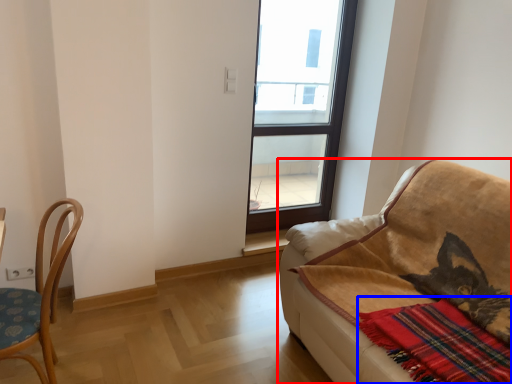
Question: Which of the following is the closest to the observer, studio couch (highlighted by a red box) or plaid (highlighted by a blue box)?

Choices:
 (A) studio couch
 (B) plaid

Answer: (A)